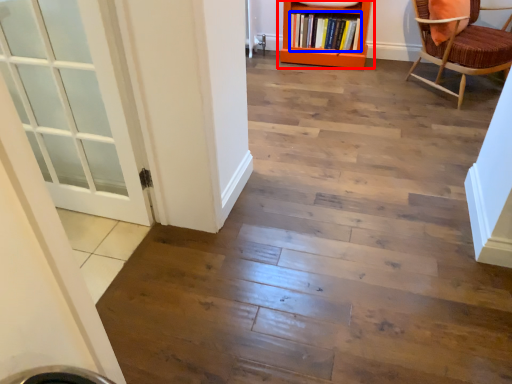
Question: Which point is further to the camera, bookcase (highlighted by a red box) or book (highlighted by a blue box)?

Choices:
 (A) bookcase
 (B) book

Answer: (B)